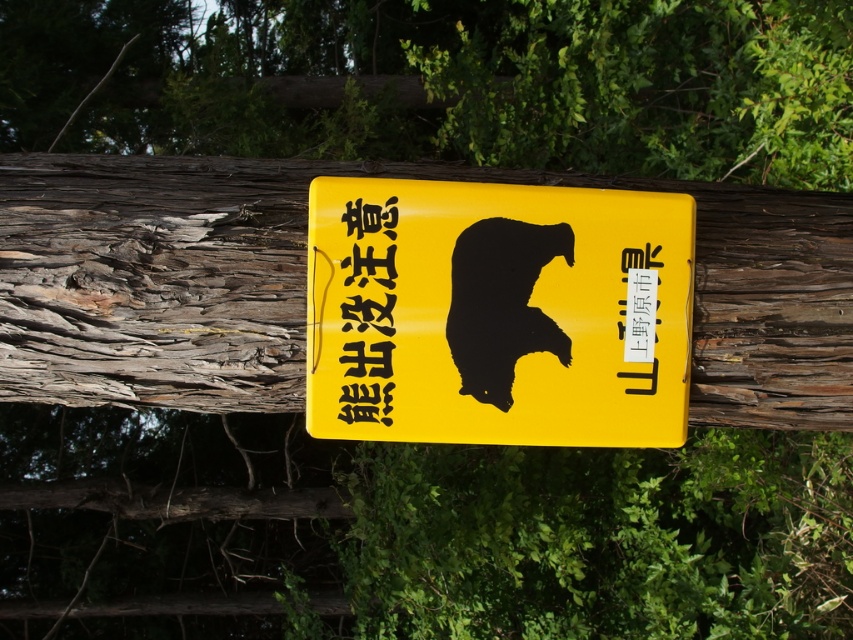
Can you confirm if rough bark tree trunk at center is taller than yellow matte signboard at center?

Yes, rough bark tree trunk at center is taller than yellow matte signboard at center.

The image size is (853, 640). I want to click on rough bark tree trunk at center, so click(x=305, y=285).

Can you confirm if rough bark tree trunk at center is positioned above yellow paper at center?

Indeed, rough bark tree trunk at center is positioned over yellow paper at center.

Can you confirm if rough bark tree trunk at center is thinner than yellow paper at center?

In fact, rough bark tree trunk at center might be wider than yellow paper at center.

Who is more distant from viewer, (36, 252) or (351, 408)?

The point (36, 252) is more distant.

Locate an element on the screen. This screenshot has height=640, width=853. rough bark tree trunk at center is located at coordinates (305, 285).

From the picture: Who is positioned more to the right, yellow matte signboard at center or yellow paper at center?

Positioned to the right is yellow matte signboard at center.

Does yellow matte signboard at center have a greater width compared to yellow paper at center?

Yes, yellow matte signboard at center is wider than yellow paper at center.

What do you see at coordinates (497, 314) in the screenshot?
I see `yellow matte signboard at center` at bounding box center [497, 314].

The height and width of the screenshot is (640, 853). In order to click on yellow matte signboard at center in this screenshot , I will do pyautogui.click(x=497, y=314).